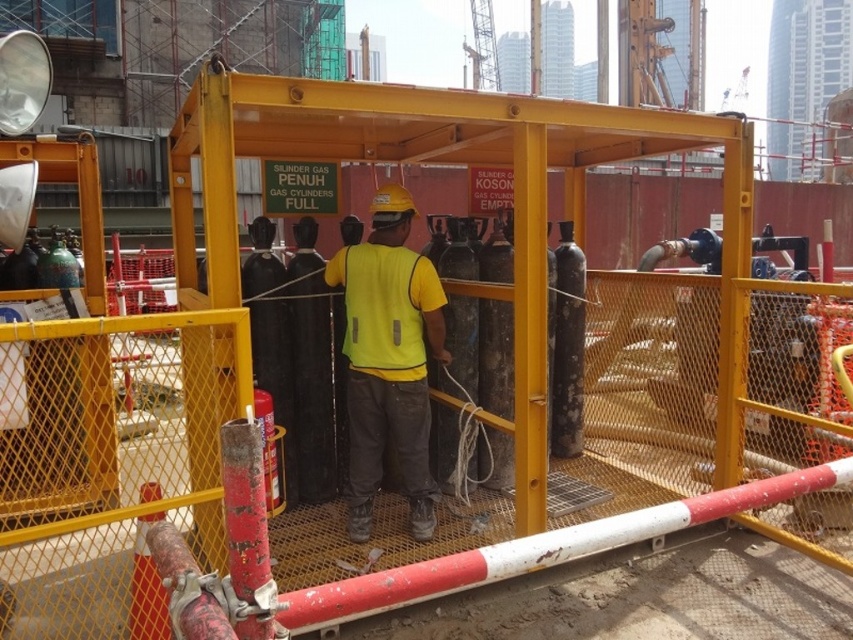
Is the position of yellow reflective vest at center more distant than that of yellow matte safety vest at center?

Yes, yellow reflective vest at center is further from the viewer.

The height and width of the screenshot is (640, 853). What do you see at coordinates (387, 358) in the screenshot? I see `yellow reflective vest at center` at bounding box center [387, 358].

The image size is (853, 640). What are the coordinates of `yellow reflective vest at center` in the screenshot? It's located at (387, 358).